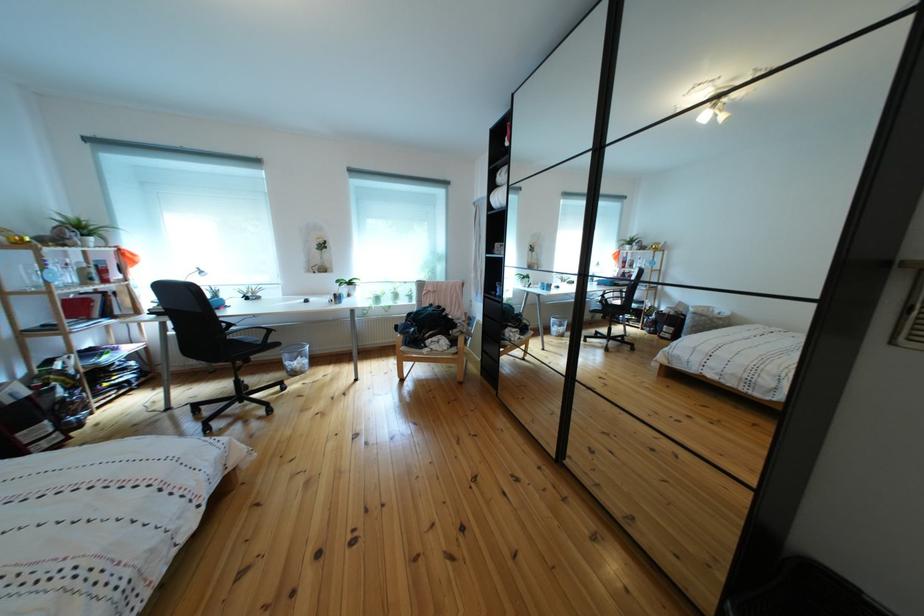
Image resolution: width=924 pixels, height=616 pixels. What do you see at coordinates (462, 336) in the screenshot?
I see `a wooden chair armrest` at bounding box center [462, 336].